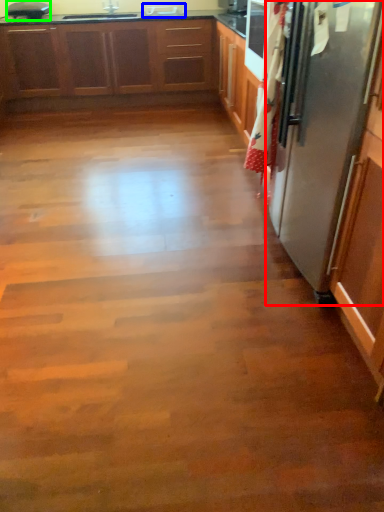
Question: Estimate the real-world distances between objects in this image. Which object is closer to refrigerator (highlighted by a red box), sink (highlighted by a blue box) or appliance (highlighted by a green box)?

Choices:
 (A) sink
 (B) appliance

Answer: (A)